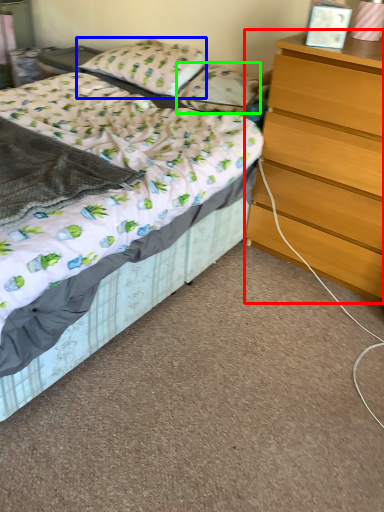
Question: Considering the real-world distances, which object is closest to chest of drawers (highlighted by a red box)? pillow (highlighted by a blue box) or pillow (highlighted by a green box).

Choices:
 (A) pillow
 (B) pillow

Answer: (B)